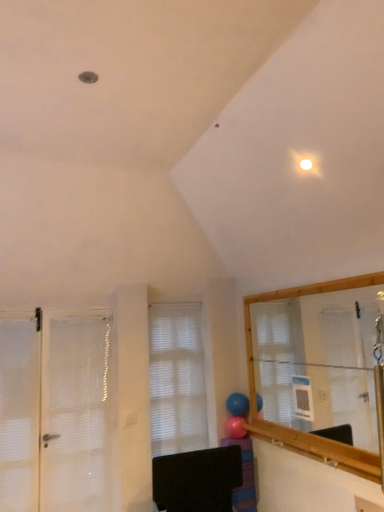
What do you see at coordinates (235, 426) in the screenshot? I see `pink rubber balloon at center, which ranks as the 2th balloon in top-to-bottom order` at bounding box center [235, 426].

This screenshot has height=512, width=384. What do you see at coordinates (244, 477) in the screenshot? I see `purple striped socks at lower center` at bounding box center [244, 477].

The image size is (384, 512). Identify the location of purple striped socks at lower center. (244, 477).

Locate an element on the screen. Image resolution: width=384 pixels, height=512 pixels. pink rubber balloon at center, which is counted as the first balloon, starting from the bottom is located at coordinates (235, 426).

Is purple striped socks at lower center to the left of rubber blue balloon at center, which is the second balloon in bottom-to-top order, from the viewer's perspective?

No, purple striped socks at lower center is not to the left of rubber blue balloon at center, which is the second balloon in bottom-to-top order.

In terms of size, does purple striped socks at lower center appear bigger or smaller than rubber blue balloon at center, which is the 1th balloon from top to bottom?

Considering their sizes, purple striped socks at lower center takes up more space than rubber blue balloon at center, which is the 1th balloon from top to bottom.

Does purple striped socks at lower center touch rubber blue balloon at center, which is the 1th balloon from top to bottom?

purple striped socks at lower center and rubber blue balloon at center, which is the 1th balloon from top to bottom, are clearly separated.

Is point (240, 497) behind point (243, 425)?

That is False.

Is purple striped socks at lower center thinner than pink rubber balloon at center, which is counted as the first balloon, starting from the bottom?

No, purple striped socks at lower center is not thinner than pink rubber balloon at center, which is counted as the first balloon, starting from the bottom.

Measure the distance between purple striped socks at lower center and pink rubber balloon at center, which ranks as the 2th balloon in top-to-bottom order.

purple striped socks at lower center and pink rubber balloon at center, which ranks as the 2th balloon in top-to-bottom order, are 10.57 inches apart.

Considering the relative sizes of purple striped socks at lower center and pink rubber balloon at center, which ranks as the 2th balloon in top-to-bottom order, in the image provided, is purple striped socks at lower center taller than pink rubber balloon at center, which ranks as the 2th balloon in top-to-bottom order,?

Yes, purple striped socks at lower center is taller than pink rubber balloon at center, which ranks as the 2th balloon in top-to-bottom order.

Who is bigger, pink rubber balloon at center, which is counted as the first balloon, starting from the bottom, or white mesh door at left?

white mesh door at left.

Considering the relative sizes of pink rubber balloon at center, which is counted as the first balloon, starting from the bottom, and white mesh door at left in the image provided, is pink rubber balloon at center, which is counted as the first balloon, starting from the bottom, thinner than white mesh door at left?

No, pink rubber balloon at center, which is counted as the first balloon, starting from the bottom, is not thinner than white mesh door at left.

Is pink rubber balloon at center, which ranks as the 2th balloon in top-to-bottom order, spatially inside white mesh door at left, or outside of it?

pink rubber balloon at center, which ranks as the 2th balloon in top-to-bottom order, is not enclosed by white mesh door at left.

Does rubber blue balloon at center, which is the 1th balloon from top to bottom, have a smaller size compared to pink rubber balloon at center, which is counted as the first balloon, starting from the bottom?

No, rubber blue balloon at center, which is the 1th balloon from top to bottom, is not smaller than pink rubber balloon at center, which is counted as the first balloon, starting from the bottom.

Which of these two, rubber blue balloon at center, which is the 1th balloon from top to bottom, or pink rubber balloon at center, which is counted as the first balloon, starting from the bottom, is thinner?

rubber blue balloon at center, which is the 1th balloon from top to bottom, is thinner.

From a real-world perspective, is rubber blue balloon at center, which is the 1th balloon from top to bottom, beneath pink rubber balloon at center, which is counted as the first balloon, starting from the bottom?

No, from a real-world perspective, rubber blue balloon at center, which is the 1th balloon from top to bottom, is not beneath pink rubber balloon at center, which is counted as the first balloon, starting from the bottom.

Where is `furniture that appears in front of the rubber blue balloon at center, which is the 1th balloon from top to bottom`? This screenshot has height=512, width=384. furniture that appears in front of the rubber blue balloon at center, which is the 1th balloon from top to bottom is located at coordinates pos(244,477).

From a real-world perspective, is rubber blue balloon at center, which is the second balloon in bottom-to-top order, below purple striped socks at lower center?

No, from a real-world perspective, rubber blue balloon at center, which is the second balloon in bottom-to-top order, is not under purple striped socks at lower center.

Is rubber blue balloon at center, which is the second balloon in bottom-to-top order, to the right of purple striped socks at lower center from the viewer's perspective?

In fact, rubber blue balloon at center, which is the second balloon in bottom-to-top order, is to the left of purple striped socks at lower center.

In the image, is purple striped socks at lower center positioned in front of or behind white matte window at center?

purple striped socks at lower center is in front of white matte window at center.

Is purple striped socks at lower center inside or outside of white matte window at center?

purple striped socks at lower center is outside white matte window at center.

Which is more distant, (251, 486) or (179, 409)?

The point (179, 409) is more distant.

Based on the photo, looking at their sizes, would you say purple striped socks at lower center is wider or thinner than white matte window at center?

purple striped socks at lower center is wider than white matte window at center.

From the image's perspective, is pink rubber balloon at center, which is counted as the first balloon, starting from the bottom, located above or below rubber blue balloon at center, which is the second balloon in bottom-to-top order?

pink rubber balloon at center, which is counted as the first balloon, starting from the bottom, is situated lower than rubber blue balloon at center, which is the second balloon in bottom-to-top order, in the image.

Which of these two, pink rubber balloon at center, which ranks as the 2th balloon in top-to-bottom order, or rubber blue balloon at center, which is the 1th balloon from top to bottom, is smaller?

pink rubber balloon at center, which ranks as the 2th balloon in top-to-bottom order, is smaller.

Which object is further away from the camera taking this photo, pink rubber balloon at center, which ranks as the 2th balloon in top-to-bottom order, or rubber blue balloon at center, which is the 1th balloon from top to bottom?

Positioned behind is rubber blue balloon at center, which is the 1th balloon from top to bottom.

Is pink rubber balloon at center, which ranks as the 2th balloon in top-to-bottom order, to the right of rubber blue balloon at center, which is the 1th balloon from top to bottom, from the viewer's perspective?

Yes, pink rubber balloon at center, which ranks as the 2th balloon in top-to-bottom order, is to the right of rubber blue balloon at center, which is the 1th balloon from top to bottom.

Find the location of a particular element. The height and width of the screenshot is (512, 384). furniture that appears on the right of rubber blue balloon at center, which is the 1th balloon from top to bottom is located at coordinates (244, 477).

Which balloon is the 1st one when counting from the back of the purple striped socks at lower center? Please provide its 2D coordinates.

[(235, 426)]

In the scene shown: Which object lies nearer to the anchor point pink rubber balloon at center, which ranks as the 2th balloon in top-to-bottom order, white matte window at center or rubber blue balloon at center, which is the second balloon in bottom-to-top order?

rubber blue balloon at center, which is the second balloon in bottom-to-top order, is closer to pink rubber balloon at center, which ranks as the 2th balloon in top-to-bottom order.

Looking at the image, which one is located further to rubber blue balloon at center, which is the second balloon in bottom-to-top order, white mesh door at left or white matte window at center?

white mesh door at left is positioned further to the anchor rubber blue balloon at center, which is the second balloon in bottom-to-top order.

Which object lies further to the anchor point rubber blue balloon at center, which is the second balloon in bottom-to-top order, white mesh door at left or purple striped socks at lower center?

white mesh door at left is further to rubber blue balloon at center, which is the second balloon in bottom-to-top order.

In the scene shown: Based on their spatial positions, is pink rubber balloon at center, which ranks as the 2th balloon in top-to-bottom order, or white matte window at center further from rubber blue balloon at center, which is the 1th balloon from top to bottom?

white matte window at center.

From the image, which object appears to be farther from white mesh door at left, purple striped socks at lower center or rubber blue balloon at center, which is the 1th balloon from top to bottom?

rubber blue balloon at center, which is the 1th balloon from top to bottom, is further to white mesh door at left.

Looking at the image, which one is located further to white mesh door at left, rubber blue balloon at center, which is the second balloon in bottom-to-top order, or pink rubber balloon at center, which is counted as the first balloon, starting from the bottom?

Among the two, pink rubber balloon at center, which is counted as the first balloon, starting from the bottom, is located further to white mesh door at left.

Considering their positions, is purple striped socks at lower center positioned further to rubber blue balloon at center, which is the 1th balloon from top to bottom, than white matte window at center?

white matte window at center is positioned further to the anchor rubber blue balloon at center, which is the 1th balloon from top to bottom.

Looking at the image, which one is located closer to pink rubber balloon at center, which is counted as the first balloon, starting from the bottom, rubber blue balloon at center, which is the 1th balloon from top to bottom, or white matte window at center?

The object closer to pink rubber balloon at center, which is counted as the first balloon, starting from the bottom, is rubber blue balloon at center, which is the 1th balloon from top to bottom.

Locate an element on the screen. balloon situated between white matte window at center and pink rubber balloon at center, which ranks as the 2th balloon in top-to-bottom order, from left to right is located at coordinates (237, 404).

Find the location of a particular element. The image size is (384, 512). window between white mesh door at left and rubber blue balloon at center, which is the second balloon in bottom-to-top order is located at coordinates (177, 379).

Identify the location of window between rubber blue balloon at center, which is the 1th balloon from top to bottom, and purple striped socks at lower center vertically. pos(177,379).

The image size is (384, 512). Find the location of `balloon between rubber blue balloon at center, which is the 1th balloon from top to bottom, and purple striped socks at lower center in the up-down direction`. balloon between rubber blue balloon at center, which is the 1th balloon from top to bottom, and purple striped socks at lower center in the up-down direction is located at coordinates (235, 426).